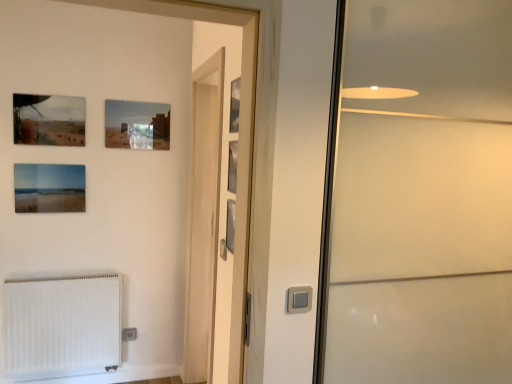
Question: Would you say metallic silver picture frame at upper center, which is the 1th picture frame from right to left, is to the left or to the right of wooden screen door at center, marked as the 1th screen door in a left-to-right arrangement, in the picture?

Choices:
 (A) left
 (B) right

Answer: (B)

Question: Looking at their shapes, would you say metallic silver picture frame at upper center, which is the 6th picture frame from back to front, is wider or thinner than wooden screen door at center, marked as the 1th screen door in a left-to-right arrangement?

Choices:
 (A) thin
 (B) wide

Answer: (A)

Question: Estimate the real-world distances between objects in this image. Which object is closer to the transparent glass screen door at right, which appears as the first screen door when viewed from the right?

Choices:
 (A) matte glass picture frame at upper left, the second picture frame from the left
 (B) white matte radiator at lower left
 (C) matte glass picture frame at upper center, which is the 4th picture frame in right-to-left order
 (D) metallic silver picture frame at upper center, acting as the first picture frame starting from the front
 (E) metallic silver picture frame at upper center, which is counted as the 5th picture frame, starting from the left

Answer: (E)

Question: Which object is positioned closest to the metallic silver picture frame at upper center, which is counted as the 5th picture frame, starting from the left?

Choices:
 (A) matte glass picture frame at upper center, which is the third picture frame in left-to-right order
 (B) metallic silver picture frame at center, which appears as the third picture frame when viewed from the right
 (C) white plastic electric outlet at lower left
 (D) white matte radiator at lower left
 (E) matte glass picture frame at lower left, acting as the 2th picture frame starting from the back

Answer: (B)